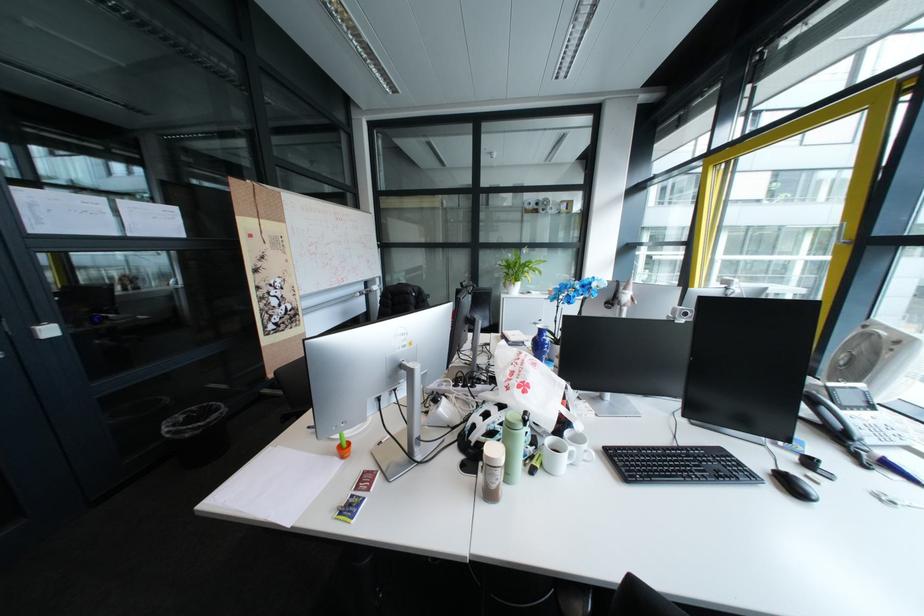
Locate an element on the screen. The width and height of the screenshot is (924, 616). brown plastic shaker is located at coordinates (492, 469).